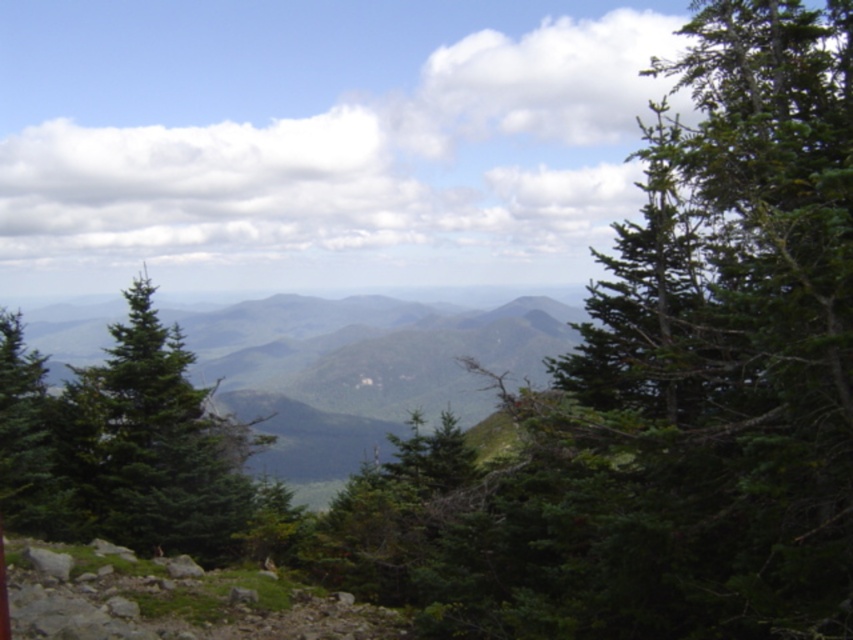
Can you confirm if green matte tree at center is bigger than green matte tree at left?

No, green matte tree at center is not bigger than green matte tree at left.

Is green matte tree at center below green matte tree at left?

Yes.

Between point (256, 444) and point (10, 396), which one is positioned behind?

Positioned behind is point (256, 444).

The image size is (853, 640). I want to click on green matte tree at center, so click(x=151, y=445).